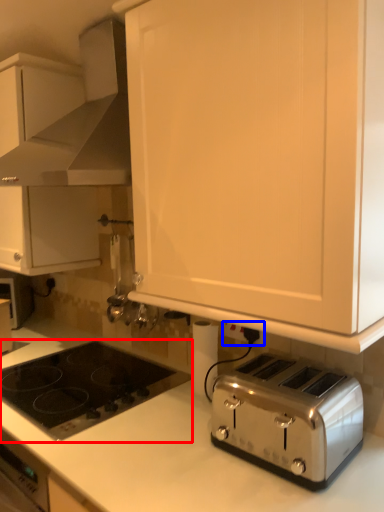
Question: Which object is further to the camera taking this photo, gas stove (highlighted by a red box) or electric outlet (highlighted by a blue box)?

Choices:
 (A) gas stove
 (B) electric outlet

Answer: (B)